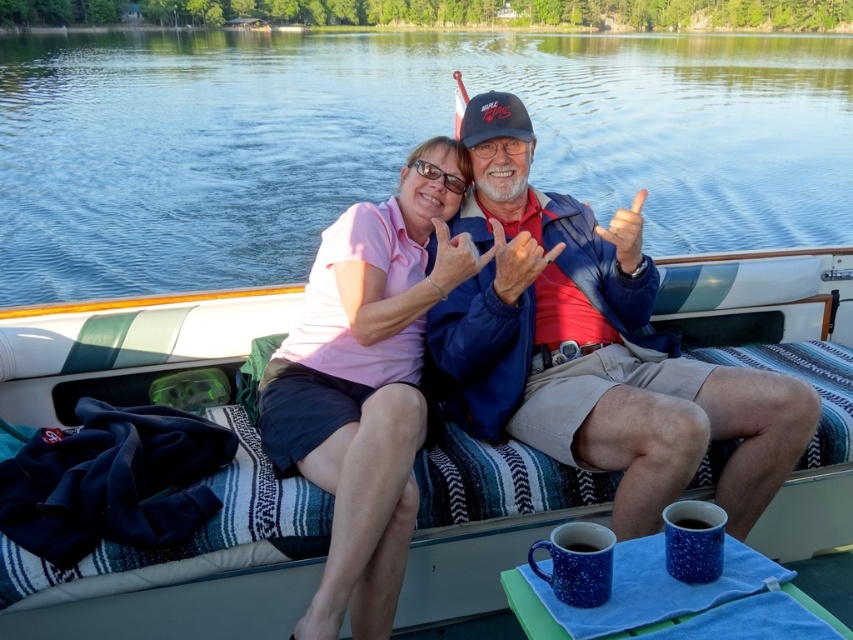
Does pink fabric shirt at center have a larger size compared to matte red hand at center?

Correct, pink fabric shirt at center is larger in size than matte red hand at center.

Consider the image. Does pink fabric shirt at center lie behind matte red hand at center?

No, it is not.

This screenshot has height=640, width=853. What are the coordinates of `pink fabric shirt at center` in the screenshot? It's located at (363, 388).

Image resolution: width=853 pixels, height=640 pixels. What are the coordinates of `pink fabric shirt at center` in the screenshot? It's located at (363, 388).

What do you see at coordinates (596, 353) in the screenshot?
I see `blue leather jacket at center` at bounding box center [596, 353].

Which is above, blue leather jacket at center or matte pink shirt at upper center?

Positioned higher is matte pink shirt at upper center.

Does point (625, 333) come farther from viewer compared to point (469, 241)?

Yes, point (625, 333) is behind point (469, 241).

Locate an element on the screen. The height and width of the screenshot is (640, 853). blue leather jacket at center is located at coordinates pyautogui.click(x=596, y=353).

Between blue leather jacket at center and pink fabric shirt at center, which one is positioned lower?

pink fabric shirt at center is below.

Who is shorter, blue leather jacket at center or pink fabric shirt at center?

blue leather jacket at center

At what (x,y) coordinates should I click in order to perform the action: click on blue leather jacket at center. Please return your answer as a coordinate pair (x, y). Image resolution: width=853 pixels, height=640 pixels. Looking at the image, I should click on (596, 353).